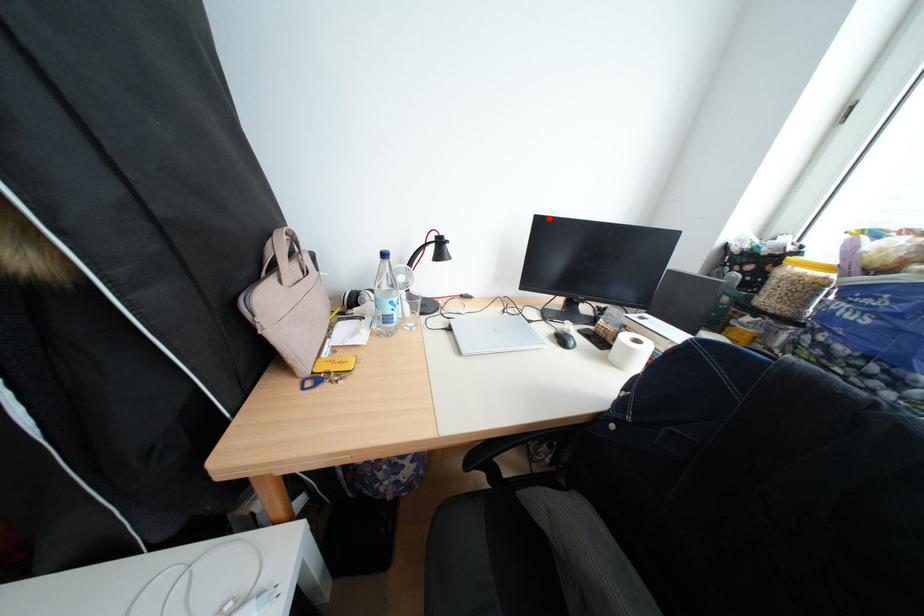
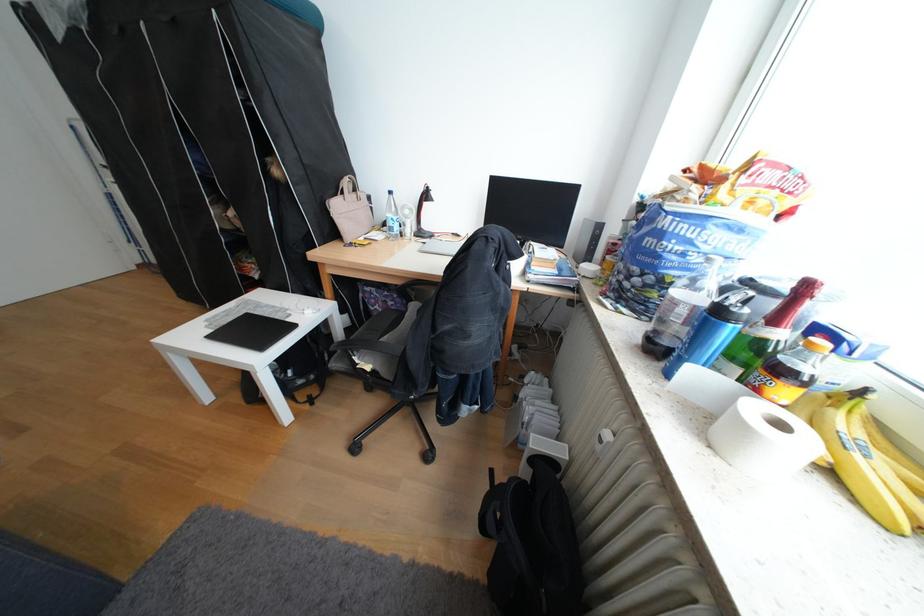
The point at the highlighted location is marked in the first image. Where is the corresponding point in the second image?

(504, 177)